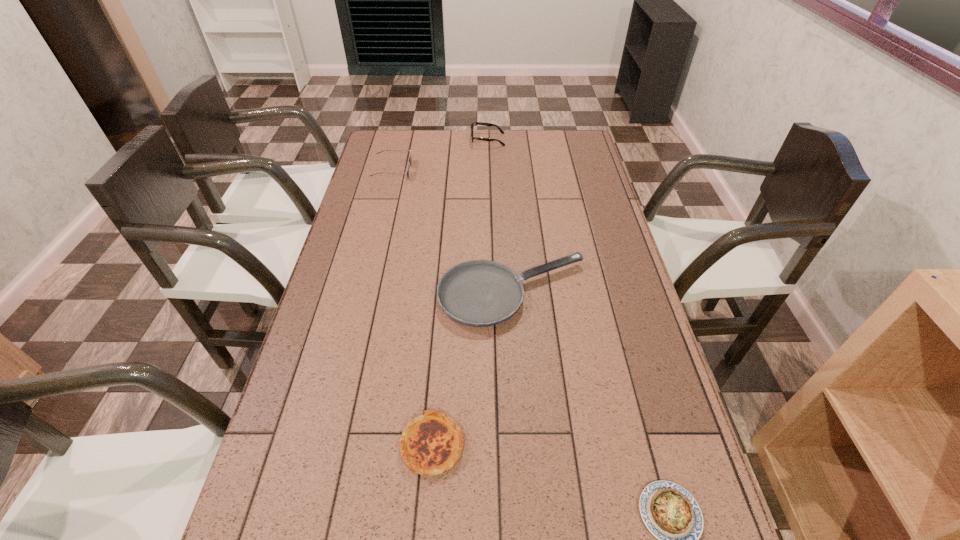
The height and width of the screenshot is (540, 960). What are the coordinates of `free space located 0.260m on the front-facing side of the fourth nearest object` in the screenshot? It's located at (477, 170).

The width and height of the screenshot is (960, 540). I want to click on free region located on the left of the third shortest object, so click(x=366, y=294).

The height and width of the screenshot is (540, 960). I want to click on vacant region located 0.210m on the right of the farther quiche, so click(x=560, y=446).

This screenshot has height=540, width=960. In order to click on object at the far edge in this screenshot , I will do `click(477, 123)`.

At what (x,y) coordinates should I click in order to perform the action: click on object that is at the left edge. Please return your answer as a coordinate pair (x, y). The height and width of the screenshot is (540, 960). Looking at the image, I should click on (410, 159).

The image size is (960, 540). Identify the location of object that is positioned at the right edge. (480, 293).

Locate an element on the screen. This screenshot has height=540, width=960. vacant space at the far edge is located at coordinates (457, 145).

The height and width of the screenshot is (540, 960). In the image, there is a desktop. Identify the location of vacant space at the left edge. (369, 290).

The width and height of the screenshot is (960, 540). In the image, there is a desktop. Identify the location of free space at the right edge. (574, 161).

You are a GUI agent. You are given a task and a screenshot of the screen. Output one action in this format:
    pyautogui.click(x=<x>, y=<y>)
    Task: Click on the vacant space at the far left corner of the desktop
    
    Given the screenshot: What is the action you would take?
    pyautogui.click(x=373, y=153)